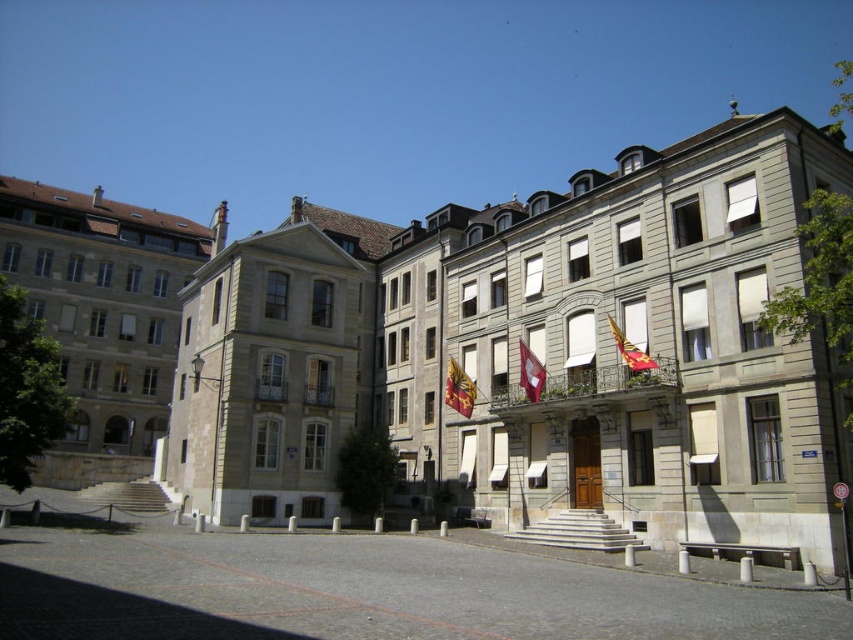
Between red fabric flag at center and red fabric flag at upper right, which one appears on the right side from the viewer's perspective?

Positioned to the right is red fabric flag at upper right.

Is red fabric flag at center to the left of red fabric flag at upper right from the viewer's perspective?

Yes, red fabric flag at center is to the left of red fabric flag at upper right.

Describe the element at coordinates (531, 372) in the screenshot. I see `red fabric flag at center` at that location.

The image size is (853, 640). I want to click on red fabric flag at center, so click(x=531, y=372).

Is gold textured flag at center positioned before red fabric flag at center?

No, gold textured flag at center is behind red fabric flag at center.

Between point (451, 372) and point (544, 371), which one is positioned in front?

Point (544, 371)

The image size is (853, 640). What are the coordinates of `gold textured flag at center` in the screenshot? It's located at (459, 388).

Between point (454, 368) and point (640, 365), which one is positioned behind?

Point (454, 368)

Measure the distance from gold textured flag at center to red fabric flag at upper right.

The distance of gold textured flag at center from red fabric flag at upper right is 19.76 meters.

I want to click on gold textured flag at center, so click(x=459, y=388).

Where is `gold textured flag at center`? gold textured flag at center is located at coordinates (459, 388).